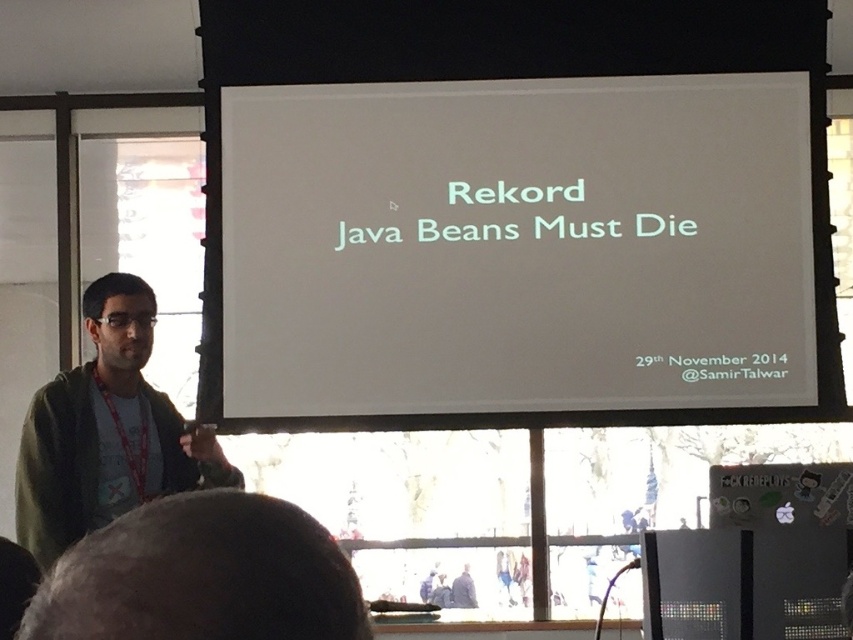
Measure the distance between white paper at center and dark green sweater at upper left.

3.76 meters

Can you confirm if white paper at center is thinner than dark green sweater at upper left?

Answer: No, white paper at center is not thinner than dark green sweater at upper left.

Is point (724, 364) positioned after point (297, 628)?

Yes, point (724, 364) is behind point (297, 628).

The width and height of the screenshot is (853, 640). Find the location of `white paper at center`. white paper at center is located at coordinates (517, 246).

Between dark green sweater at upper left and green casual shirt at left, which one is positioned lower?

green casual shirt at left is lower down.

Who is shorter, dark green sweater at upper left or green casual shirt at left?

dark green sweater at upper left is shorter.

The height and width of the screenshot is (640, 853). What do you see at coordinates (201, 576) in the screenshot?
I see `dark green sweater at upper left` at bounding box center [201, 576].

Where is `dark green sweater at upper left`? dark green sweater at upper left is located at coordinates (201, 576).

Can you confirm if white paper at center is smaller than green casual shirt at left?

No.

Is white paper at center taller than green casual shirt at left?

Yes, white paper at center is taller than green casual shirt at left.

The image size is (853, 640). Describe the element at coordinates (517, 246) in the screenshot. I see `white paper at center` at that location.

At what (x,y) coordinates should I click in order to perform the action: click on white paper at center. Please return your answer as a coordinate pair (x, y). This screenshot has height=640, width=853. Looking at the image, I should click on (517, 246).